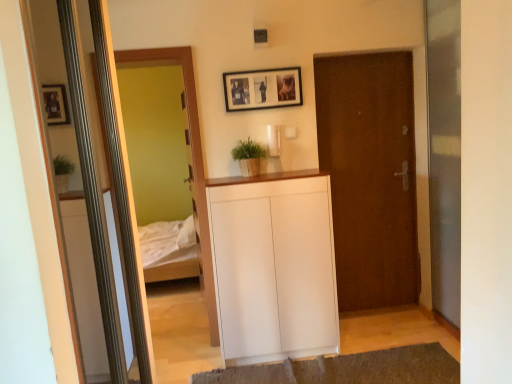
Where is `free region on the left part of green matte plant at center`? The image size is (512, 384). free region on the left part of green matte plant at center is located at coordinates (221, 180).